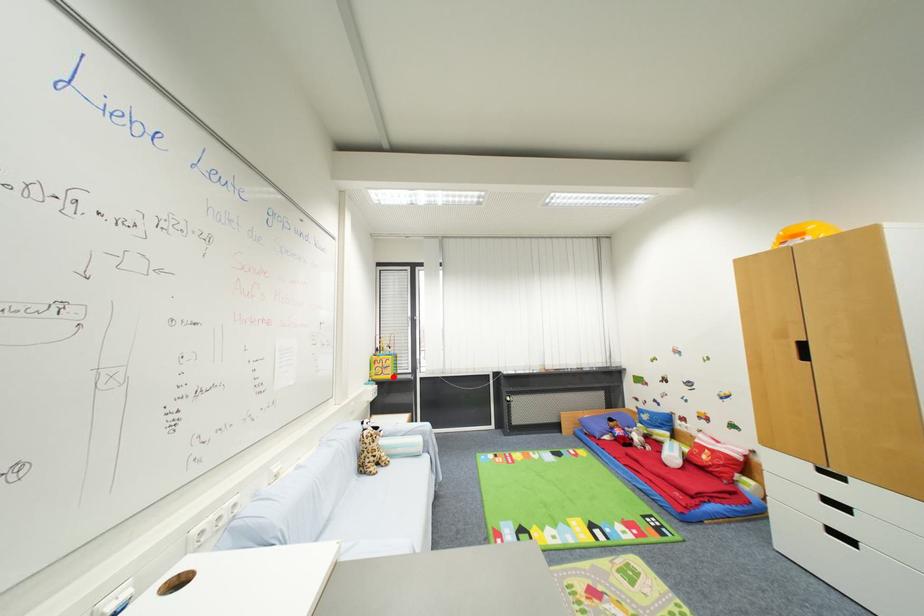
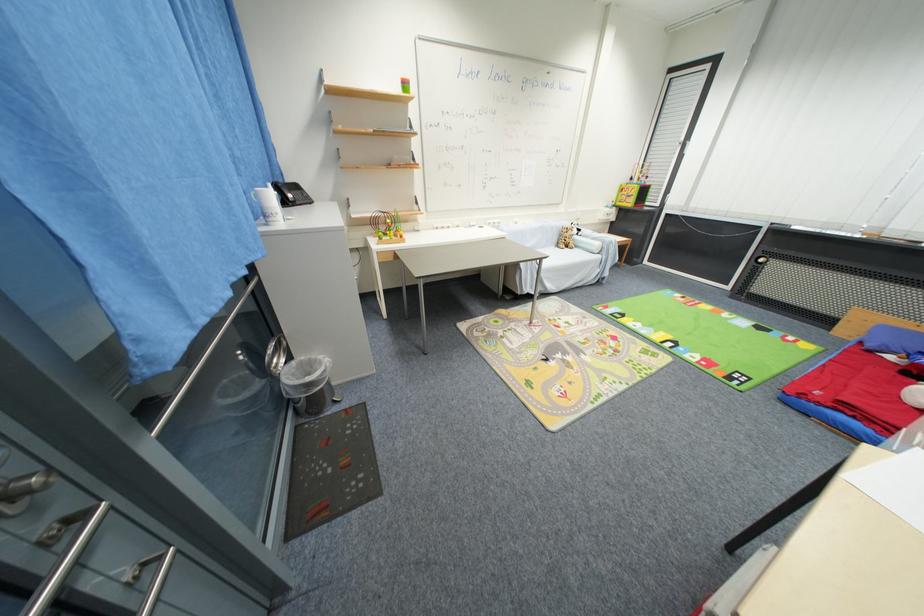
The point at the highlighted location is marked in the first image. Where is the corresponding point in the second image?

(635, 206)